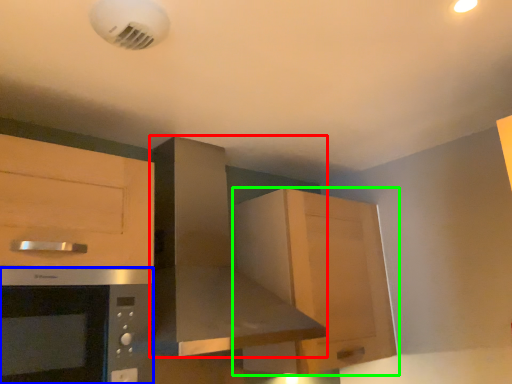
Question: Which is farther away from home appliance (highlighted by a red box)? microwave oven (highlighted by a blue box) or cabinetry (highlighted by a green box)?

Choices:
 (A) microwave oven
 (B) cabinetry

Answer: (A)